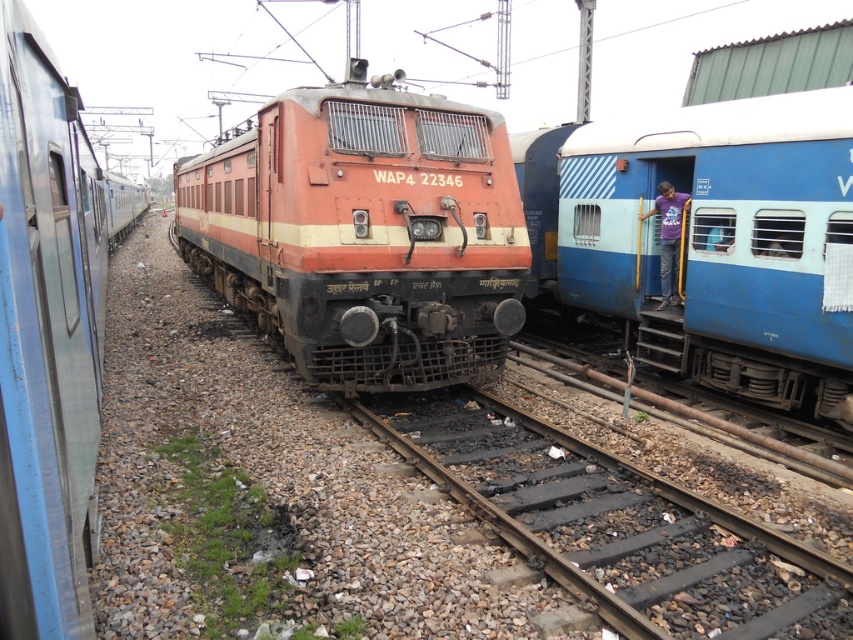
The width and height of the screenshot is (853, 640). I want to click on orange matte train at center, so click(x=364, y=232).

Can you confirm if orange matte train at center is positioned to the right of matte blue train at center?

Indeed, orange matte train at center is positioned on the right side of matte blue train at center.

Measure the distance between orange matte train at center and camera.

They are 22.24 feet apart.

Image resolution: width=853 pixels, height=640 pixels. What are the coordinates of `orange matte train at center` in the screenshot? It's located at (364, 232).

Between point (606, 234) and point (811, 552), which one is positioned in front?

Point (811, 552) is in front.

Locate an element on the screen. blue metallic passenger train at right is located at coordinates (708, 241).

Who is more forward, (300,275) or (422,420)?

Point (300,275) is in front.

The height and width of the screenshot is (640, 853). Describe the element at coordinates (364, 232) in the screenshot. I see `orange matte train at center` at that location.

Locate an element on the screen. orange matte train at center is located at coordinates (364, 232).